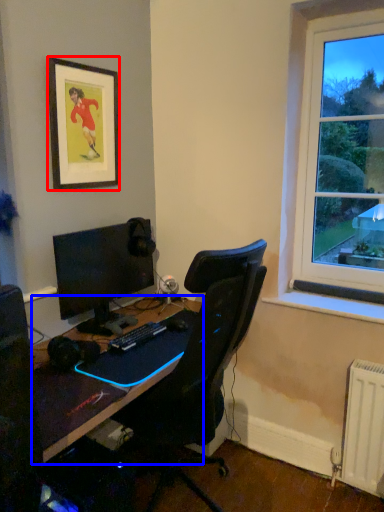
Question: Which object appears farthest to the camera in this image, picture frame (highlighted by a red box) or desk (highlighted by a blue box)?

Choices:
 (A) picture frame
 (B) desk

Answer: (A)